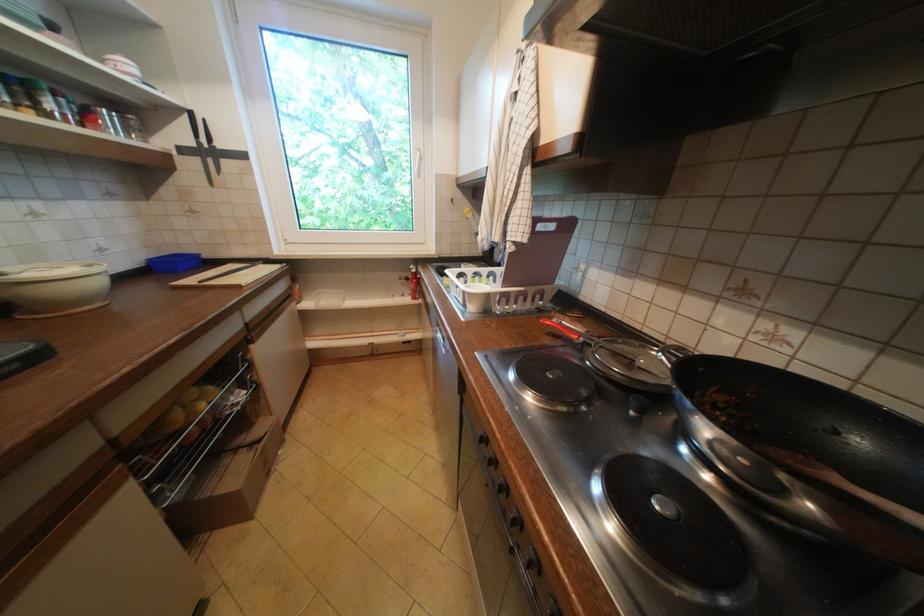
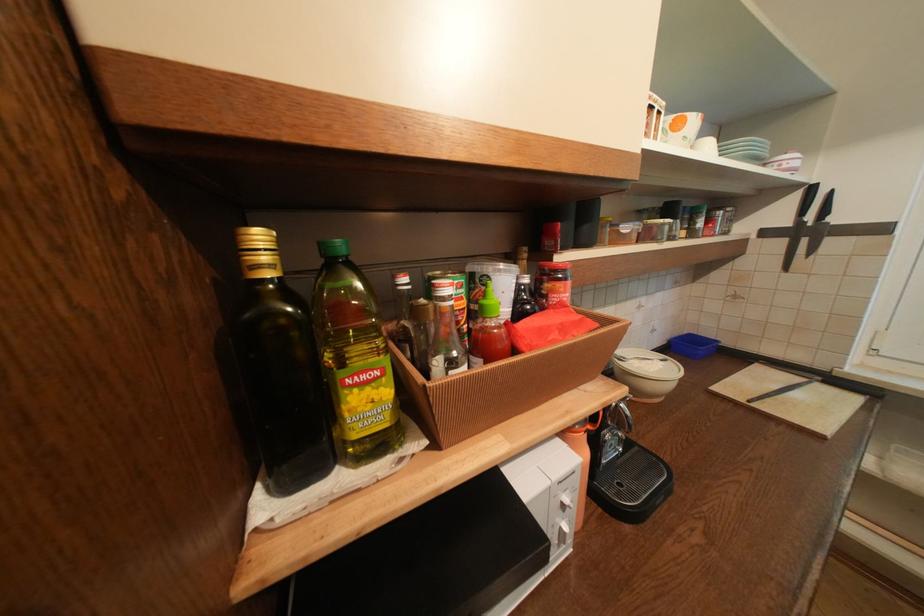
Question: I am providing you with two images of the same scene from different viewpoints. Which of the following objects are not visible in image2?

Choices:
 (A) gold bottle cap
 (B) dark glass bottle
 (C) black knife handle
 (D) none of these

Answer: (D)